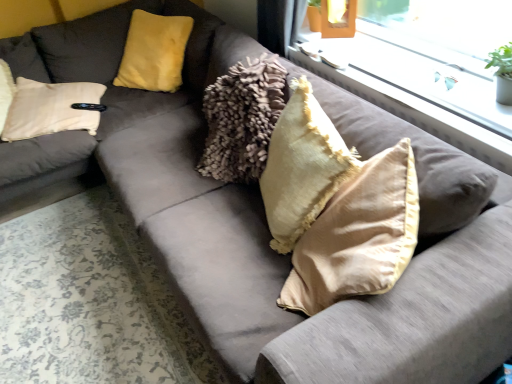
Question: Does satin beige pillow at center, the 1th pillow in the front-to-back sequence, touch clear glass window at upper center?

Choices:
 (A) yes
 (B) no

Answer: (B)

Question: From a real-world perspective, is satin beige pillow at center, the first pillow in the right-to-left sequence, on clear glass window at upper center?

Choices:
 (A) yes
 (B) no

Answer: (B)

Question: Can you confirm if satin beige pillow at center, the third pillow in the left-to-right sequence, is positioned to the left of clear glass window at upper center?

Choices:
 (A) no
 (B) yes

Answer: (B)

Question: Is satin beige pillow at center, the third pillow in the left-to-right sequence, far from clear glass window at upper center?

Choices:
 (A) no
 (B) yes

Answer: (A)

Question: Is satin beige pillow at center, the 3th pillow positioned from the back, closer to the viewer compared to clear glass window at upper center?

Choices:
 (A) yes
 (B) no

Answer: (A)

Question: Does satin beige pillow at center, the 1th pillow in the front-to-back sequence, contain clear glass window at upper center?

Choices:
 (A) yes
 (B) no

Answer: (B)

Question: Is clear glass window at upper center facing away from satin beige pillow at center, the 3th pillow positioned from the back?

Choices:
 (A) no
 (B) yes

Answer: (A)

Question: Does clear glass window at upper center lie in front of satin beige pillow at center, the 3th pillow positioned from the back?

Choices:
 (A) no
 (B) yes

Answer: (A)

Question: Does clear glass window at upper center touch satin beige pillow at center, the third pillow in the left-to-right sequence?

Choices:
 (A) yes
 (B) no

Answer: (B)

Question: Can you confirm if clear glass window at upper center is shorter than satin beige pillow at center, the 1th pillow in the front-to-back sequence?

Choices:
 (A) no
 (B) yes

Answer: (B)

Question: From the image's perspective, does clear glass window at upper center appear lower than satin beige pillow at center, the first pillow in the right-to-left sequence?

Choices:
 (A) no
 (B) yes

Answer: (A)

Question: Does clear glass window at upper center have a greater width compared to satin beige pillow at center, the first pillow in the right-to-left sequence?

Choices:
 (A) no
 (B) yes

Answer: (A)

Question: From the image's perspective, is velvet yellow pillow at upper left, which appears as the third pillow when viewed from the right, under satin beige pillow at center, the third pillow in the left-to-right sequence?

Choices:
 (A) no
 (B) yes

Answer: (A)